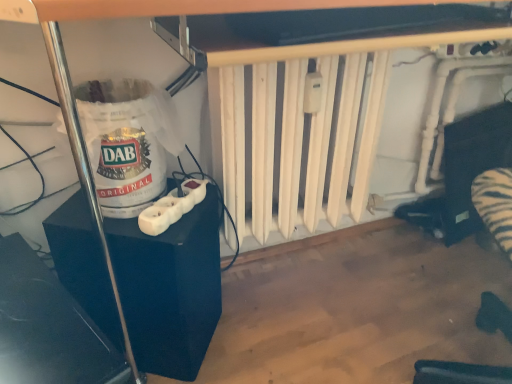
Locate an element on the screen. The height and width of the screenshot is (384, 512). black plastic power strip at left is located at coordinates (170, 288).

You are a GUI agent. You are given a task and a screenshot of the screen. Output one action in this format:
    pyautogui.click(x=<x>, y=<y>)
    Task: Click on the water heater on the left of the white plastic wii controller at lower left
    This screenshot has height=384, width=512.
    Given the screenshot: What is the action you would take?
    pyautogui.click(x=127, y=142)

From the image's perspective, is white plastic wii controller at lower left under white paper bag at left?

Yes, from the image's perspective, white plastic wii controller at lower left is below white paper bag at left.

Looking at this image, is white plastic wii controller at lower left facing away from white paper bag at left?

Correct, white plastic wii controller at lower left is looking away from white paper bag at left.

Between white plastic wii controller at lower left and white paper bag at left, which one has smaller size?

white plastic wii controller at lower left.

In the image, is black plastic power strip at left positioned in front of or behind white matte radiator at center?

In the image, black plastic power strip at left appears in front of white matte radiator at center.

Is white matte radiator at center at the back of black plastic power strip at left?

No, white matte radiator at center is not at the back of black plastic power strip at left.

Does black plastic power strip at left have a lesser width compared to white matte radiator at center?

No, black plastic power strip at left is not thinner than white matte radiator at center.

This screenshot has height=384, width=512. In the image, there is a white matte radiator at center. What are the coordinates of `furniture below it (from the image's perspective)` in the screenshot? It's located at (170, 288).

Where is `wide below the black plastic power strip at left (from the image's perspective)`? This screenshot has width=512, height=384. wide below the black plastic power strip at left (from the image's perspective) is located at coordinates (48, 327).

Which is in front, black plastic power strip at left or glossy plastic speaker at lower left?

glossy plastic speaker at lower left.

Looking at this image, would you consider black plastic power strip at left to be distant from glossy plastic speaker at lower left?

black plastic power strip at left is actually quite close to glossy plastic speaker at lower left.

From a real-world perspective, is black plastic power strip at left above or below glossy plastic speaker at lower left?

From a real-world perspective, black plastic power strip at left is physically below glossy plastic speaker at lower left.

Based on the photo, is glossy plastic speaker at lower left next to white matte radiator at center and touching it?

No, glossy plastic speaker at lower left is not in contact with white matte radiator at center.

Can you confirm if glossy plastic speaker at lower left is bigger than white matte radiator at center?

No.

Would you say glossy plastic speaker at lower left is inside or outside white matte radiator at center?

glossy plastic speaker at lower left is outside white matte radiator at center.

Is glossy plastic speaker at lower left taller or shorter than white matte radiator at center?

In the image, glossy plastic speaker at lower left appears to be shorter than white matte radiator at center.

Is white matte radiator at center looking in the opposite direction of black plastic power strip at left?

white matte radiator at center is not turned away from black plastic power strip at left.

Is white matte radiator at center beside black plastic power strip at left?

They are not placed beside each other.

Is point (254, 110) closer or farther from the camera than point (127, 283)?

Point (254, 110).

Considering the relative sizes of glossy plastic speaker at lower left and black plastic power strip at left in the image provided, is glossy plastic speaker at lower left taller than black plastic power strip at left?

Yes, glossy plastic speaker at lower left is taller than black plastic power strip at left.

Is glossy plastic speaker at lower left behind black plastic power strip at left?

No, glossy plastic speaker at lower left is closer to the camera.

Does glossy plastic speaker at lower left turn towards black plastic power strip at left?

No, glossy plastic speaker at lower left does not turn towards black plastic power strip at left.

Which is in front, point (75, 90) or point (111, 375)?

The point (111, 375) is in front.

Is white paper bag at left at the left side of glossy plastic speaker at lower left?

No, white paper bag at left is not to the left of glossy plastic speaker at lower left.

From the image's perspective, is white paper bag at left positioned above or below glossy plastic speaker at lower left?

white paper bag at left is situated higher than glossy plastic speaker at lower left in the image.

The image size is (512, 384). What are the coordinates of `water heater above the white plastic wii controller at lower left (from a real-world perspective)` in the screenshot? It's located at (127, 142).

At what (x,y) coordinates should I click in order to perform the action: click on furniture below the white matte radiator at center (from the image's perspective). Please return your answer as a coordinate pair (x, y). The width and height of the screenshot is (512, 384). Looking at the image, I should click on (170, 288).

When comparing their distances from glossy plastic speaker at lower left, does white paper bag at left or white matte radiator at center seem closer?

white paper bag at left is closer to glossy plastic speaker at lower left.

Estimate the real-world distances between objects in this image. Which object is further from black plastic power strip at left, white plastic wii controller at lower left or glossy plastic speaker at lower left?

glossy plastic speaker at lower left is positioned further to the anchor black plastic power strip at left.

From the image, which object appears to be farther from glossy plastic speaker at lower left, white matte radiator at center or white paper bag at left?

white matte radiator at center.

When comparing their distances from white paper bag at left, does glossy plastic speaker at lower left or white matte radiator at center seem further?

white matte radiator at center is further to white paper bag at left.

Looking at the image, which one is located closer to white matte radiator at center, white paper bag at left or black plastic power strip at left?

black plastic power strip at left lies closer to white matte radiator at center than the other object.

Estimate the real-world distances between objects in this image. Which object is further from white plastic wii controller at lower left, black plastic power strip at left or white paper bag at left?

Among the two, black plastic power strip at left is located further to white plastic wii controller at lower left.

Looking at the image, which one is located further to black plastic power strip at left, white plastic wii controller at lower left or white matte radiator at center?

white matte radiator at center is further to black plastic power strip at left.

In the scene shown: When comparing their distances from glossy plastic speaker at lower left, does white plastic wii controller at lower left or black plastic power strip at left seem closer?

black plastic power strip at left is closer to glossy plastic speaker at lower left.

The height and width of the screenshot is (384, 512). Identify the location of furniture between glossy plastic speaker at lower left and white matte radiator at center in the horizontal direction. (170, 288).

Locate an element on the screen. This screenshot has width=512, height=384. furniture between white paper bag at left and glossy plastic speaker at lower left vertically is located at coordinates (170, 288).

Locate an element on the screen. Wii controller between glossy plastic speaker at lower left and white matte radiator at center from left to right is located at coordinates (172, 207).

Locate an element on the screen. This screenshot has width=512, height=384. Wii controller between black plastic power strip at left and white matte radiator at center from left to right is located at coordinates (172, 207).